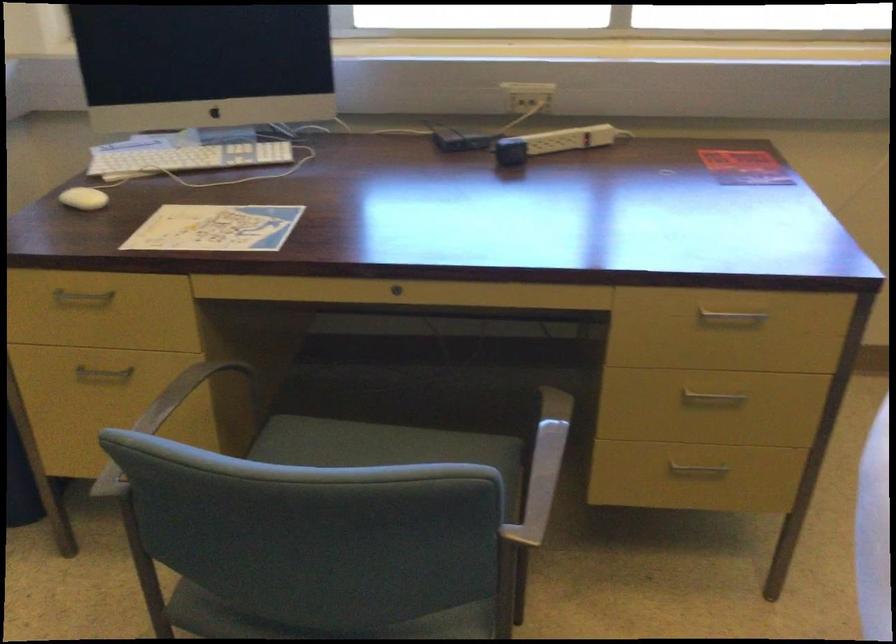
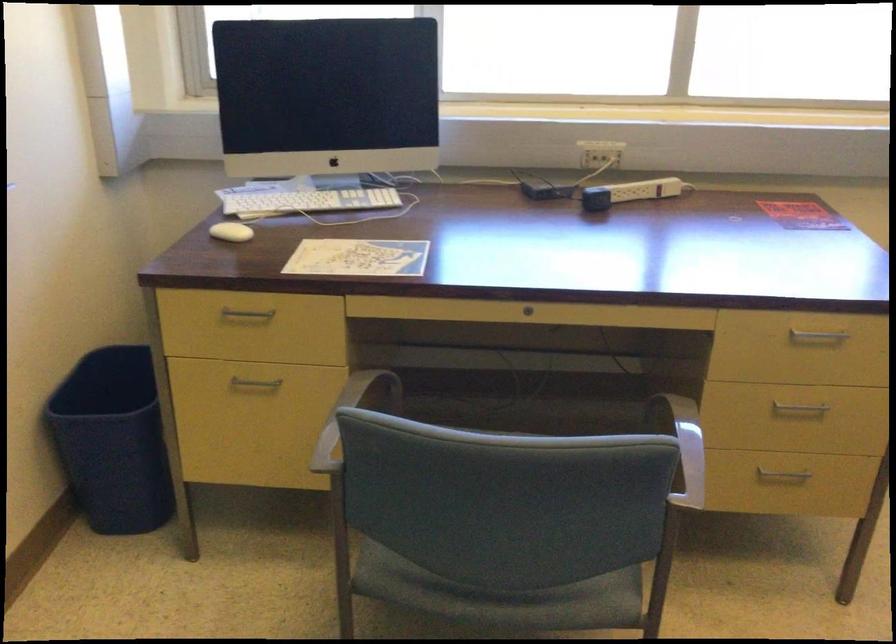
Locate, in the second image, the point that corresponds to point (563, 138) in the first image.

(642, 190)